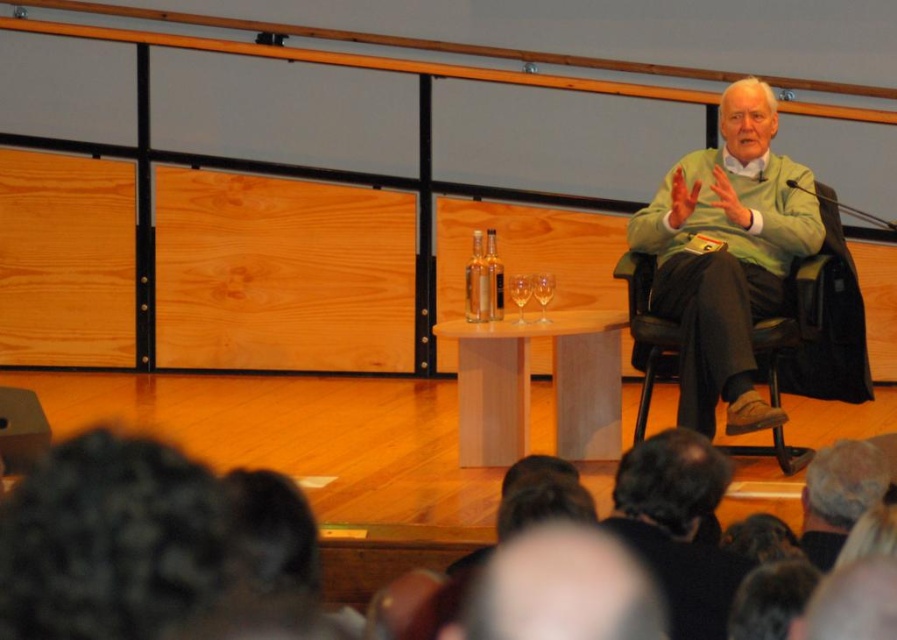
Question: Which of these objects is positioned closest to the clear glass wine glass at center?

Choices:
 (A) transparent glass at center
 (B) green matte sweater at center
 (C) dark brown hair at lower center

Answer: (A)

Question: Can you confirm if green matte sweater at center is thinner than transparent glass at center?

Choices:
 (A) yes
 (B) no

Answer: (B)

Question: Which point appears closest to the camera in this image?

Choices:
 (A) (804, 205)
 (B) (533, 291)
 (C) (702, 476)
 (D) (514, 282)

Answer: (C)

Question: Is green matte sweater at center thinner than transparent glass at center?

Choices:
 (A) no
 (B) yes

Answer: (A)

Question: Which point is closer to the camera?

Choices:
 (A) green matte sweater at center
 (B) clear glass wine glass at center

Answer: (A)

Question: Is green matte sweater at center to the left of clear glass wine glass at center from the viewer's perspective?

Choices:
 (A) yes
 (B) no

Answer: (B)